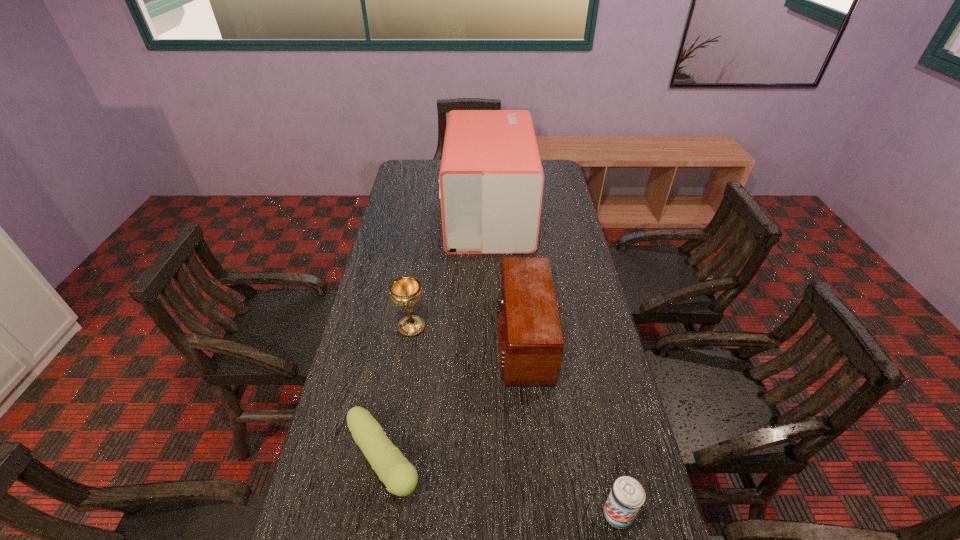
At what (x,y) coordinates should I click in order to perform the action: click on vacant point located 0.110m on the front-facing side of the radio receiver. Please return your answer as a coordinate pair (x, y). Looking at the image, I should click on (460, 338).

Find the location of a particular element. vacant area situated on the front-facing side of the radio receiver is located at coordinates (453, 338).

Where is `vacant space located on the front-facing side of the radio receiver`? This screenshot has height=540, width=960. vacant space located on the front-facing side of the radio receiver is located at coordinates (370, 338).

The width and height of the screenshot is (960, 540). I want to click on vacant space situated on the back of the chalice, so click(x=419, y=283).

Identify the location of blank area located on the left of the beer can. Image resolution: width=960 pixels, height=540 pixels. [437, 514].

In order to click on vacant area situated 0.300m on the back of the shortest object in this screenshot , I will do pyautogui.click(x=405, y=330).

At what (x,y) coordinates should I click in order to perform the action: click on object that is at the far edge. Please return your answer as a coordinate pair (x, y). This screenshot has width=960, height=540. Looking at the image, I should click on (491, 179).

Where is `chalice located at the left edge`? The width and height of the screenshot is (960, 540). chalice located at the left edge is located at coordinates (406, 291).

At what (x,y) coordinates should I click in order to perform the action: click on cucumber located in the left edge section of the desktop. Please return your answer as a coordinate pair (x, y). This screenshot has height=540, width=960. Looking at the image, I should click on (400, 477).

Locate an element on the screen. object present at the right edge is located at coordinates (627, 495).